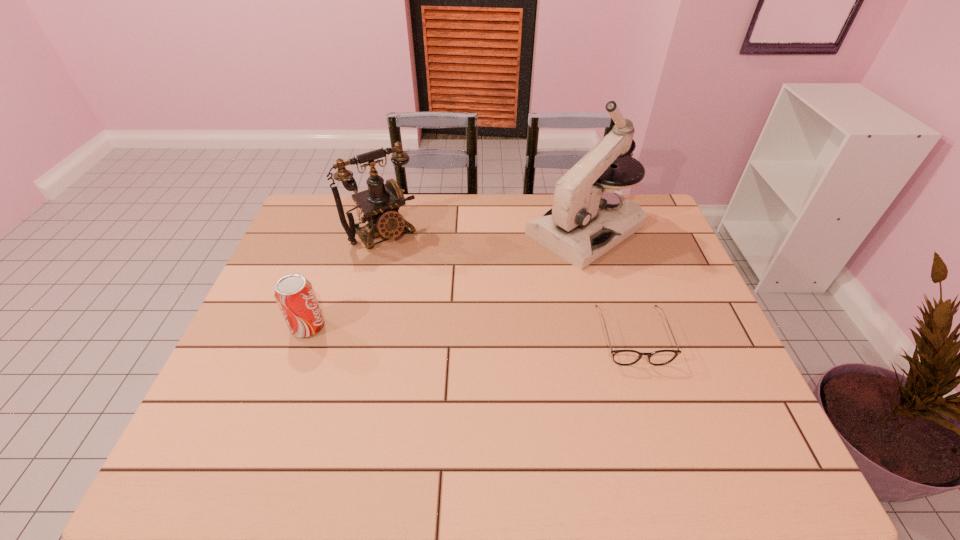
Where is `vacant space on the desktop that is between the third tallest object and the spectacles and is positioned on the rotary dial of the telephone`? vacant space on the desktop that is between the third tallest object and the spectacles and is positioned on the rotary dial of the telephone is located at coordinates (464, 332).

At what (x,y) coordinates should I click in order to perform the action: click on free space on the desktop that is between the second shortest object and the spectacles and is positioned at the eyepiece of the tallest object. Please return your answer as a coordinate pair (x, y). This screenshot has height=540, width=960. Looking at the image, I should click on pyautogui.click(x=428, y=330).